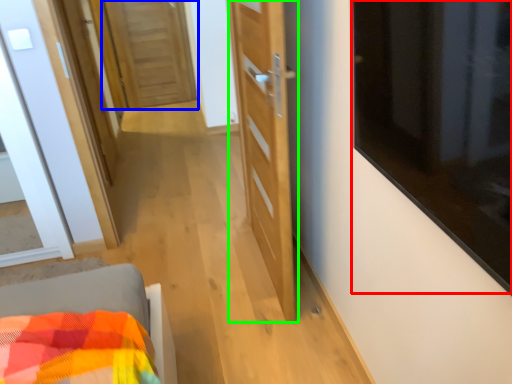
Question: Considering the real-world distances, which object is closest to window (highlighted by a red box)? door (highlighted by a blue box) or door (highlighted by a green box).

Choices:
 (A) door
 (B) door

Answer: (B)